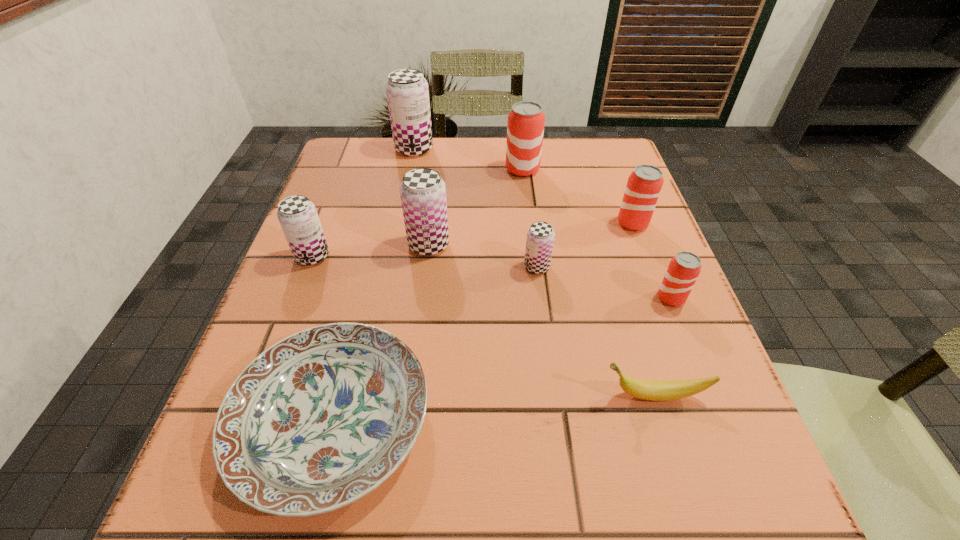
Find the location of `blank space at the far edge of the desktop`. blank space at the far edge of the desktop is located at coordinates (461, 178).

At what (x,y) coordinates should I click in order to perform the action: click on vacant area at the near edge. Please return your answer as a coordinate pair (x, y). The height and width of the screenshot is (540, 960). Looking at the image, I should click on (475, 521).

Locate an element on the screen. This screenshot has width=960, height=540. vacant space at the left edge of the desktop is located at coordinates (363, 255).

Where is `vacant space at the right edge`? The height and width of the screenshot is (540, 960). vacant space at the right edge is located at coordinates (676, 326).

Locate an element on the screen. The image size is (960, 540). vacant space at the far left corner of the desktop is located at coordinates (367, 165).

Locate an element on the screen. The height and width of the screenshot is (540, 960). vacant space at the far right corner of the desktop is located at coordinates (570, 172).

This screenshot has width=960, height=540. In order to click on vacant space at the near right corner in this screenshot , I will do `click(705, 492)`.

Identify the location of free space between the leftmost orange beer can and the plate. (427, 295).

Find the location of a particular element. free space between the smallest purple beer can and the leftmost beer can is located at coordinates (424, 261).

I want to click on vacant point located between the second farthest orange beer can and the third biggest purple beer can, so click(x=472, y=240).